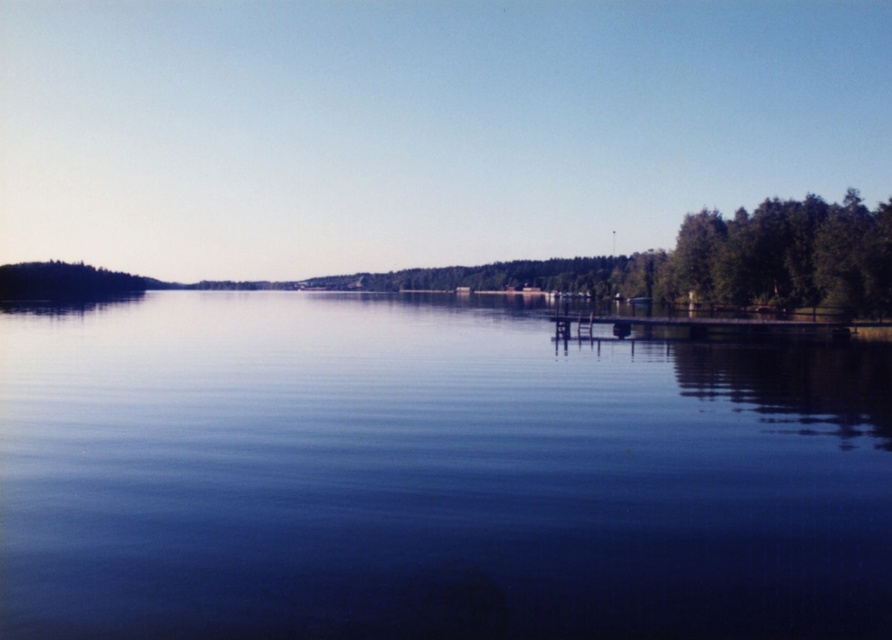
Who is positioned more to the right, blue smooth water at center or wooden dock at right?

Positioned to the right is wooden dock at right.

Does blue smooth water at center have a lesser height compared to wooden dock at right?

In fact, blue smooth water at center may be taller than wooden dock at right.

Between point (348, 412) and point (575, 330), which one is positioned in front?

Point (348, 412) is in front.

Find the location of a particular element. blue smooth water at center is located at coordinates (430, 476).